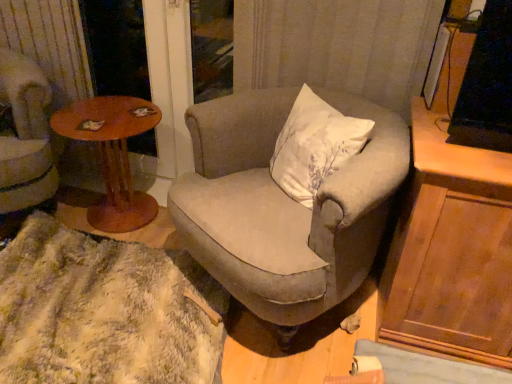
Question: Is textured beige armchair at center, which ranks as the 1th chair in right-to-left order, bigger or smaller than velvet beige armchair at left, acting as the second chair starting from the right?

Choices:
 (A) big
 (B) small

Answer: (A)

Question: In the image, is textured beige armchair at center, which is the 2th chair in left-to-right order, positioned in front of or behind velvet beige armchair at left, the first chair in the left-to-right sequence?

Choices:
 (A) front
 (B) behind

Answer: (A)

Question: Which object is positioned farthest from the wooden round table at left?

Choices:
 (A) fuzzy white rug at lower left
 (B) brown wooden screen door at upper left
 (C) textured beige armchair at center, which is the 2th chair in left-to-right order
 (D) velvet beige armchair at left, acting as the second chair starting from the right
 (E) wooden cabinet at right

Answer: (E)

Question: Based on their relative distances, which object is farther from the wooden cabinet at right?

Choices:
 (A) velvet beige armchair at left, the first chair in the left-to-right sequence
 (B) fuzzy white rug at lower left
 (C) textured beige armchair at center, which ranks as the 1th chair in right-to-left order
 (D) brown wooden screen door at upper left
 (E) wooden round table at left

Answer: (A)